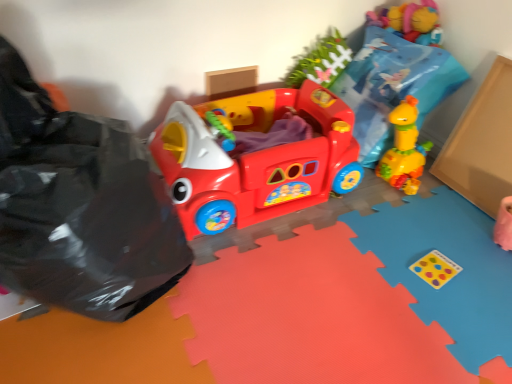
Describe the element at coordinates (254, 158) in the screenshot. I see `matte plastic play car at center` at that location.

In order to face matte plastic play car at center, should I rotate leftwards or rightwards?

Rotate left and turn 0.206 degrees.

Where is `matte plastic play car at center`? matte plastic play car at center is located at coordinates (254, 158).

Image resolution: width=512 pixels, height=384 pixels. Describe the element at coordinates (80, 207) in the screenshot. I see `black plastic bag at left` at that location.

In order to click on black plastic bag at left in this screenshot , I will do `click(80, 207)`.

At what (x,y) coordinates should I click in order to perform the action: click on matte plastic play car at center. Please return your answer as a coordinate pair (x, y). This screenshot has width=512, height=384. Looking at the image, I should click on point(254,158).

Looking at this image, is black plastic bag at left to the left of matte plastic play car at center from the viewer's perspective?

Yes, black plastic bag at left is to the left of matte plastic play car at center.

Relative to matte plastic play car at center, is black plastic bag at left in front or behind?

In the image, black plastic bag at left appears in front of matte plastic play car at center.

Does point (25, 207) appear closer or farther from the camera than point (307, 99)?

Point (25, 207) is closer to the camera than point (307, 99).

From the image's perspective, would you say black plastic bag at left is positioned over matte plastic play car at center?

No, from the image's perspective, black plastic bag at left is not on top of matte plastic play car at center.

From a real-world perspective, which is physically above, black plastic bag at left or matte plastic play car at center?

In real-world perspective, black plastic bag at left is above.

Considering the sizes of black plastic bag at left and matte plastic play car at center in the image, is black plastic bag at left wider or thinner than matte plastic play car at center?

In the image, black plastic bag at left appears to be more narrow than matte plastic play car at center.

Based on the photo, between black plastic bag at left and matte plastic play car at center, which one has less height?

With less height is matte plastic play car at center.

Which of these two, black plastic bag at left or matte plastic play car at center, is bigger?

Bigger between the two is black plastic bag at left.

From the picture: Is black plastic bag at left not within matte plastic play car at center?

Yes, black plastic bag at left is outside of matte plastic play car at center.

Is black plastic bag at left beside matte plastic play car at center?

black plastic bag at left and matte plastic play car at center are not in contact.

Is matte plastic play car at center at the back of black plastic bag at left?

No, black plastic bag at left is not facing the opposite direction of matte plastic play car at center.

Where is `toy below the black plastic bag at left (from a real-world perspective)`? toy below the black plastic bag at left (from a real-world perspective) is located at coordinates (254, 158).

Which is more to the right, matte plastic play car at center or black plastic bag at left?

matte plastic play car at center.

Based on the photo, is matte plastic play car at center further to the viewer compared to black plastic bag at left?

Yes, it is behind black plastic bag at left.

Does point (348, 139) come behind point (41, 248)?

That is True.

From the image's perspective, which object appears higher, matte plastic play car at center or black plastic bag at left?

matte plastic play car at center is shown above in the image.

Consider the image. From a real-world perspective, is matte plastic play car at center positioned under black plastic bag at left based on gravity?

Correct, in the physical world, matte plastic play car at center is lower than black plastic bag at left.

Does matte plastic play car at center have a lesser width compared to black plastic bag at left?

No.

Is matte plastic play car at center taller than black plastic bag at left?

No, matte plastic play car at center is not taller than black plastic bag at left.

Looking at this image, in terms of size, does matte plastic play car at center appear bigger or smaller than black plastic bag at left?

Clearly, matte plastic play car at center is smaller in size than black plastic bag at left.

Is matte plastic play car at center inside or outside of black plastic bag at left?

matte plastic play car at center exists outside the volume of black plastic bag at left.

Is the surface of matte plastic play car at center in direct contact with black plastic bag at left?

Answer: No, matte plastic play car at center is not next to black plastic bag at left.

Could you tell me if matte plastic play car at center is facing black plastic bag at left?

No.

What's the angular difference between matte plastic play car at center and black plastic bag at left's facing directions?

There is a 0.00188-degree angle between the facing directions of matte plastic play car at center and black plastic bag at left.

Measure the distance between matte plastic play car at center and black plastic bag at left.

matte plastic play car at center and black plastic bag at left are 13.71 inches apart.

Locate an element on the screen. Image resolution: width=512 pixels, height=384 pixels. toy beneath the black plastic bag at left (from a real-world perspective) is located at coordinates (254, 158).

Identify the location of garbage below the matte plastic play car at center (from the image's perspective). (80, 207).

This screenshot has width=512, height=384. Find the location of `garbage that is in front of the matte plastic play car at center`. garbage that is in front of the matte plastic play car at center is located at coordinates (80, 207).